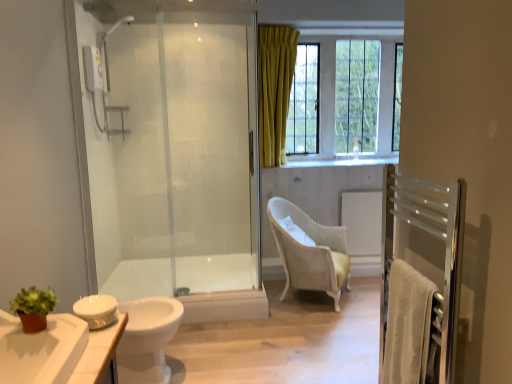
Question: Is matte glass window at upper right to the left of white glossy cabinet at lower left from the viewer's perspective?

Choices:
 (A) yes
 (B) no

Answer: (B)

Question: Can you see matte glass window at upper right touching white glossy cabinet at lower left?

Choices:
 (A) no
 (B) yes

Answer: (A)

Question: Considering the relative sizes of matte glass window at upper right and white glossy cabinet at lower left in the image provided, is matte glass window at upper right taller than white glossy cabinet at lower left?

Choices:
 (A) yes
 (B) no

Answer: (A)

Question: Is white glossy cabinet at lower left at the back of matte glass window at upper right?

Choices:
 (A) yes
 (B) no

Answer: (B)

Question: Does matte glass window at upper right lie in front of white glossy cabinet at lower left?

Choices:
 (A) yes
 (B) no

Answer: (B)

Question: From a real-world perspective, is white glossy cabinet at lower left above or below transparent glass shower door at left?

Choices:
 (A) below
 (B) above

Answer: (A)

Question: Looking at the image, does white glossy cabinet at lower left seem bigger or smaller compared to transparent glass shower door at left?

Choices:
 (A) small
 (B) big

Answer: (A)

Question: Based on their positions, is white glossy cabinet at lower left located to the left or right of transparent glass shower door at left?

Choices:
 (A) right
 (B) left

Answer: (B)

Question: Does point (10, 326) appear closer or farther from the camera than point (103, 178)?

Choices:
 (A) closer
 (B) farther

Answer: (A)

Question: Is white glossy bathtub at center bigger or smaller than white glossy faucet at upper center?

Choices:
 (A) big
 (B) small

Answer: (A)

Question: Considering the relative positions of white glossy bathtub at center and white glossy faucet at upper center in the image provided, is white glossy bathtub at center to the left or to the right of white glossy faucet at upper center?

Choices:
 (A) right
 (B) left

Answer: (B)

Question: From the image's perspective, relative to white glossy faucet at upper center, is white glossy bathtub at center above or below?

Choices:
 (A) above
 (B) below

Answer: (B)

Question: Considering the positions of point (226, 304) and point (356, 152), is point (226, 304) closer or farther from the camera than point (356, 152)?

Choices:
 (A) closer
 (B) farther

Answer: (A)

Question: From the image's perspective, is white glossy toilet at lower left above or below matte glass window at upper right?

Choices:
 (A) below
 (B) above

Answer: (A)

Question: Would you say white glossy toilet at lower left is to the left or to the right of matte glass window at upper right in the picture?

Choices:
 (A) right
 (B) left

Answer: (B)